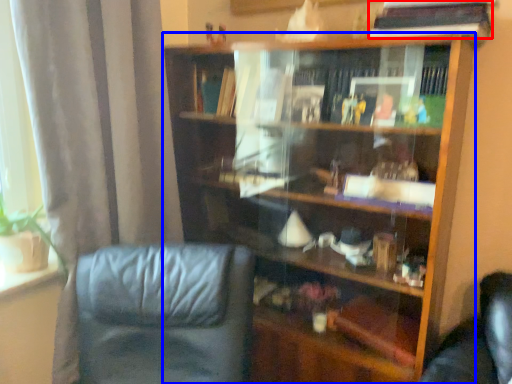
Question: Which point is further to the camera, book (highlighted by a red box) or bookcase (highlighted by a blue box)?

Choices:
 (A) book
 (B) bookcase

Answer: (A)